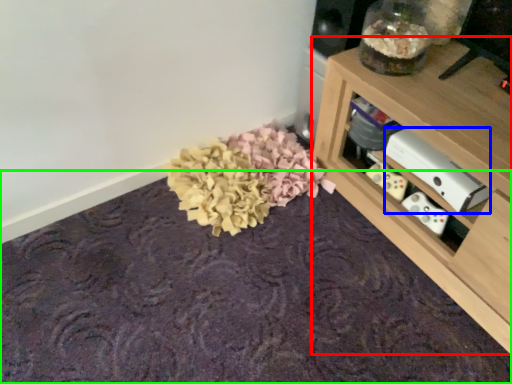
Question: Estimate the real-world distances between objects in this image. Which object is closer to shelf (highlighted by a red box), appliance (highlighted by a blue box) or mat (highlighted by a green box)?

Choices:
 (A) appliance
 (B) mat

Answer: (A)